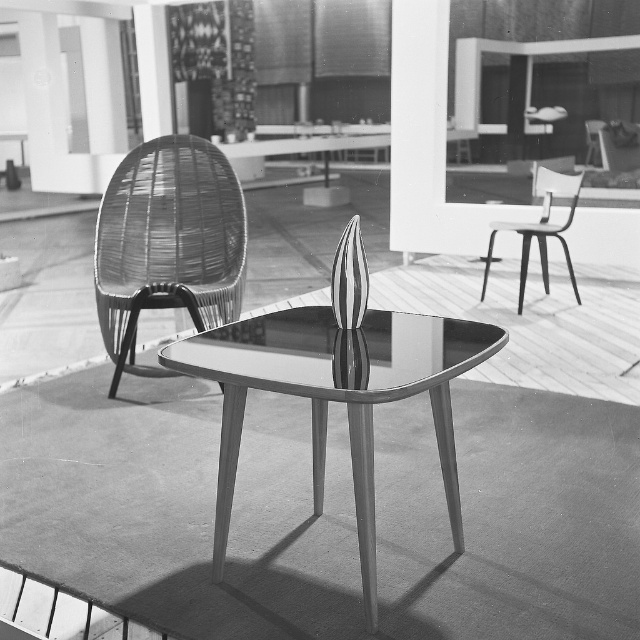
You are an interior designer planning to move the metallic silver chair at right to a different room. Before moving it, you need to check if there is enough space between the metallic glass table at center and the wall behind it. Can you confirm if the space is sufficient?

The metallic glass table at center is positioned under the metallic silver chair at right, so moving the chair would leave space behind the table. However, the description does not provide specific measurements about the distance between the table and the wall, so it is unclear if there is enough space.

You are an interior designer planning to place a 1.2 meter wide sofa between the woven rattan chair at left and the metallic silver chair at right. Based on the scene, will there be enough space between the two chairs to fit the sofa?

The woven rattan chair at left is wider than the metallic silver chair at right. However, the exact distance between them isn

You are a photographer trying to capture the scene from the camera position. You notice two points marked in the image. Which point, point (323, 390) or point (196, 230), appears closer to your camera lens?

Point (323, 390) is closer to the camera than point (196, 230).